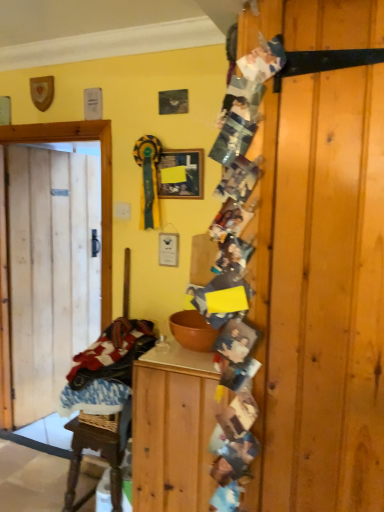
Question: From their relative heights in the image, would you say matte black picture frame at upper center is taller or shorter than plaid fabric laundry at left?

Choices:
 (A) tall
 (B) short

Answer: (B)

Question: Based on their positions, is matte black picture frame at upper center located to the left or right of plaid fabric laundry at left?

Choices:
 (A) right
 (B) left

Answer: (A)

Question: Which of these objects is positioned farthest from the wooden cabinet at center?

Choices:
 (A) matte black picture frame at upper center
 (B) plaid fabric laundry at left
 (C) natural wood door at left

Answer: (A)

Question: Considering the real-world distances, which object is closest to the plaid fabric laundry at left?

Choices:
 (A) wooden cabinet at center
 (B) natural wood door at left
 (C) matte black picture frame at upper center

Answer: (A)